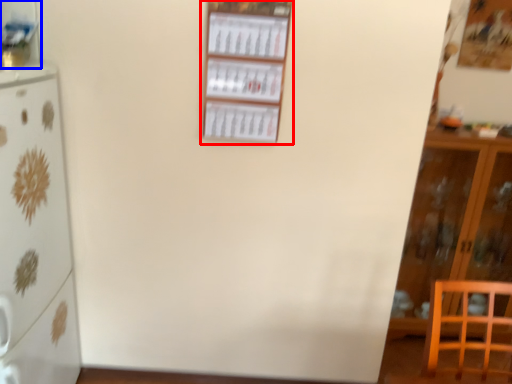
Question: Which of the following is the farthest to the observer, shelf (highlighted by a red box) or shelf (highlighted by a blue box)?

Choices:
 (A) shelf
 (B) shelf

Answer: (A)